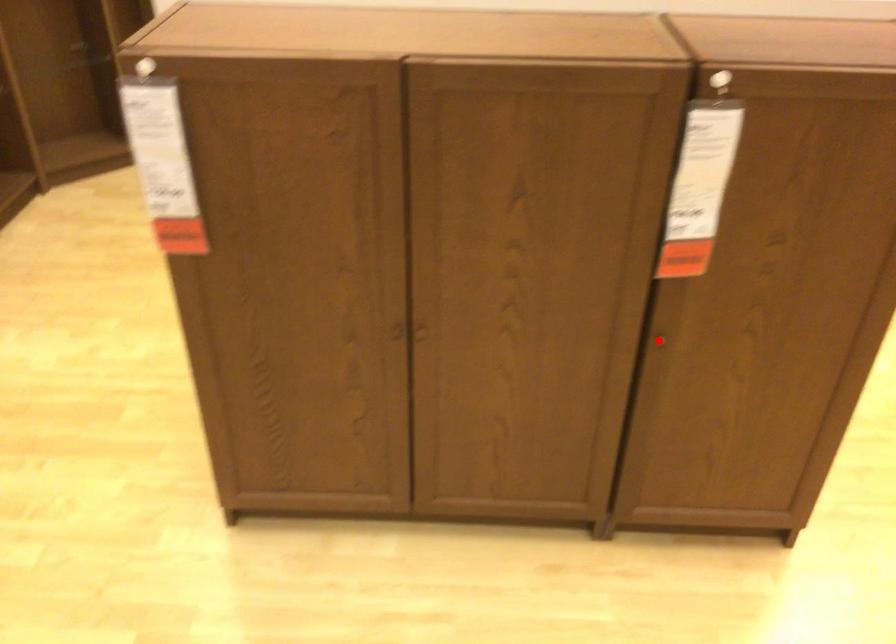
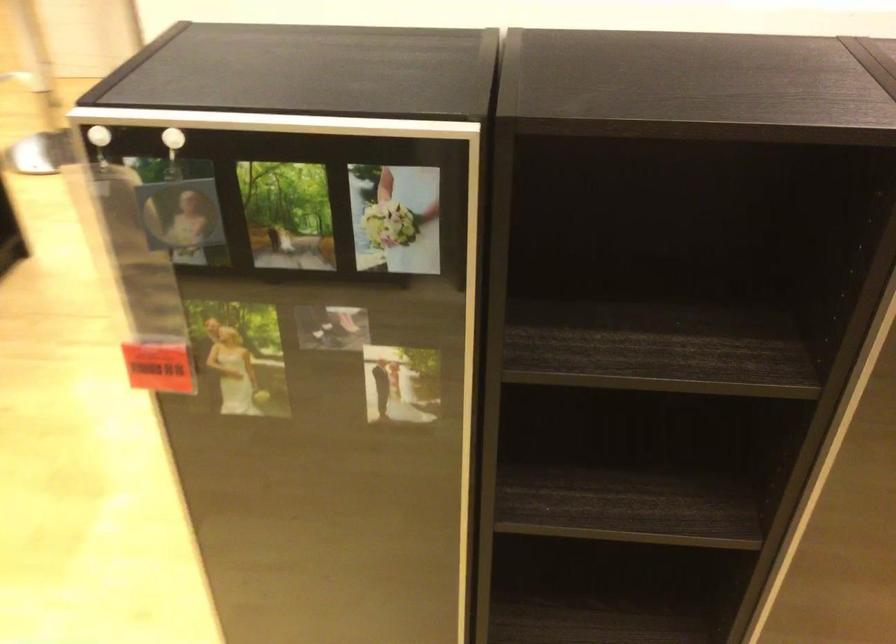
Question: I am providing you with two images of the same scene from different viewpoints. A red point is marked on the first image. Can you still see the location of the red point in image 2?

Choices:
 (A) Yes
 (B) No

Answer: (B)